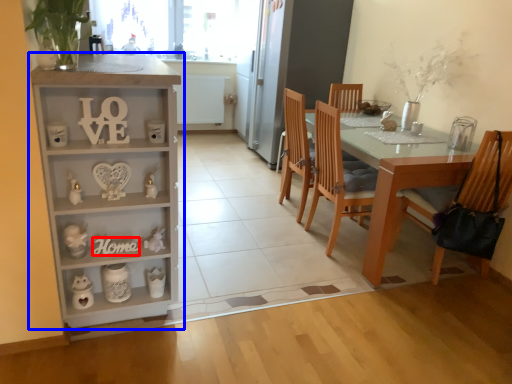
Question: Among these objects, which one is farthest to the camera, number (highlighted by a red box) or cabinetry (highlighted by a blue box)?

Choices:
 (A) number
 (B) cabinetry

Answer: (A)